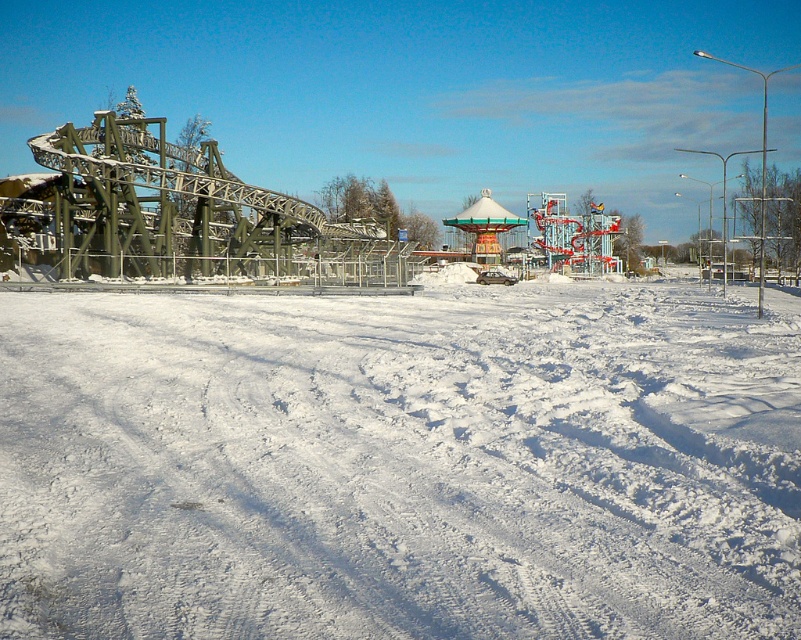
From the picture: You are a visitor at the amusement park and want to walk to the entrance located at the lower center. There is white snow at lower center and a metal roller coaster at left. Which object will you step on first?

The white snow at lower center is positioned under the metal roller coaster at left, so you will step on the white snow at lower center first before reaching the entrance.

You are standing at the roller coaster on the left side of the amusement park. You want to walk to the carousel to your right. There is a point marked at coordinates [399,465]. Is this point on the path between the roller coaster and the carousel?

The point [399,465] is on white snow at lower center. Since the path between the roller coaster and the carousel would logically be along the snow in the foreground, the point is likely on the path between them.

You are planning to build a snowman using the white snow at lower center. However, you also want to ensure that the metal roller coaster at left remains visible from your current viewpoint. Considering the width of the snow area, will you have enough space to build the snowman without blocking the view of the roller coaster?

The white snow at lower center has a width less than the metal roller coaster at left, so building a snowman there would not obstruct the view of the roller coaster since the snow area is narrower and positioned in front but not wide enough to cover the roller coaster in the view.